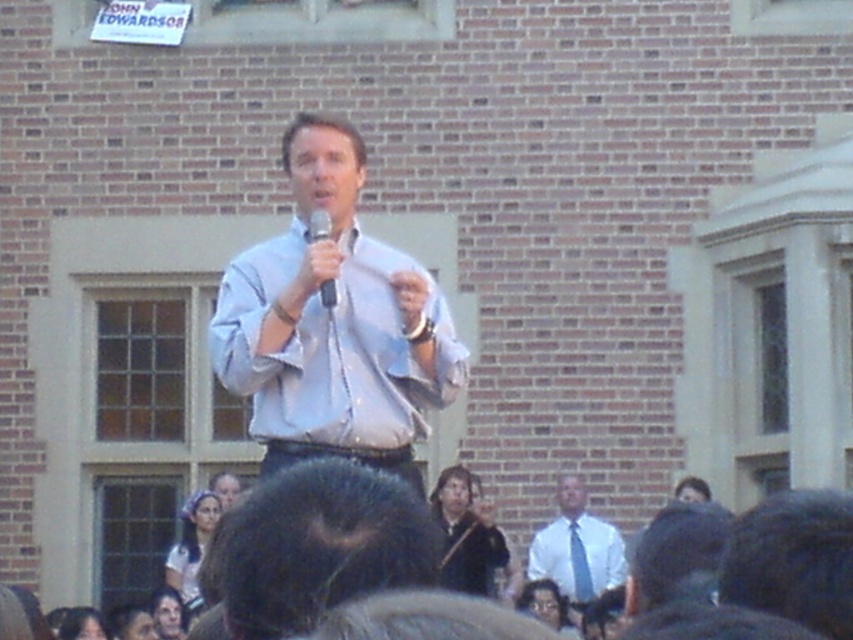
Does light brown hair at lower left appear on the right side of smooth skin face at lower left?

Indeed, light brown hair at lower left is positioned on the right side of smooth skin face at lower left.

Where is `light brown hair at lower left`? The height and width of the screenshot is (640, 853). light brown hair at lower left is located at coordinates (190, 545).

Does point (392, 294) come farther from viewer compared to point (582, 563)?

No, (392, 294) is closer to viewer.

Is light blue cotton shirt at center to the right of blue silk tie at center from the viewer's perspective?

Incorrect, light blue cotton shirt at center is not on the right side of blue silk tie at center.

Locate an element on the screen. Image resolution: width=853 pixels, height=640 pixels. light blue cotton shirt at center is located at coordinates (332, 348).

Does light brown hair at lower left appear under white matte microphone at center?

Correct, light brown hair at lower left is located below white matte microphone at center.

Does light brown hair at lower left have a smaller size compared to white matte microphone at center?

Incorrect, light brown hair at lower left is not smaller in size than white matte microphone at center.

Does point (195, 520) come closer to viewer compared to point (328, 284)?

No, (195, 520) is behind (328, 284).

The width and height of the screenshot is (853, 640). I want to click on light brown hair at lower left, so pos(190,545).